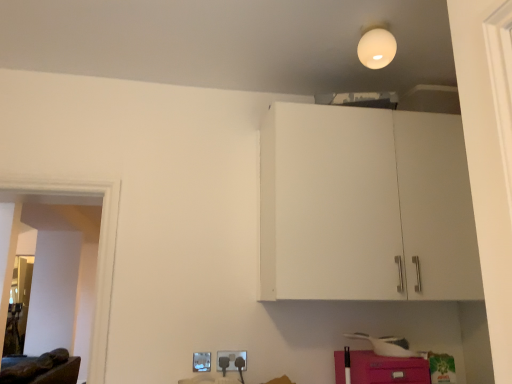
Question: From the image's perspective, is matte plastic electric outlet at lower center, which appears as the 1th electric outlet when viewed from the right, below brown leather couch at lower left?

Choices:
 (A) no
 (B) yes

Answer: (A)

Question: Considering the relative sizes of matte plastic electric outlet at lower center, which is the second electric outlet from left to right, and brown leather couch at lower left in the image provided, is matte plastic electric outlet at lower center, which is the second electric outlet from left to right, smaller than brown leather couch at lower left?

Choices:
 (A) no
 (B) yes

Answer: (B)

Question: Are matte plastic electric outlet at lower center, which is the second electric outlet from left to right, and brown leather couch at lower left far apart?

Choices:
 (A) yes
 (B) no

Answer: (A)

Question: Does matte plastic electric outlet at lower center, which appears as the 1th electric outlet when viewed from the right, touch brown leather couch at lower left?

Choices:
 (A) yes
 (B) no

Answer: (B)

Question: From a real-world perspective, does matte plastic electric outlet at lower center, which appears as the 1th electric outlet when viewed from the right, sit lower than brown leather couch at lower left?

Choices:
 (A) yes
 (B) no

Answer: (B)

Question: Is matte plastic electric outlet at lower center, which is the second electric outlet from left to right, to the left or to the right of white matte light bulb at upper center in the image?

Choices:
 (A) right
 (B) left

Answer: (B)

Question: From a real-world perspective, relative to white matte light bulb at upper center, is matte plastic electric outlet at lower center, which is the second electric outlet from left to right, vertically above or below?

Choices:
 (A) above
 (B) below

Answer: (B)

Question: In terms of height, does matte plastic electric outlet at lower center, which is the second electric outlet from left to right, look taller or shorter compared to white matte light bulb at upper center?

Choices:
 (A) tall
 (B) short

Answer: (B)

Question: Is matte plastic electric outlet at lower center, which appears as the 1th electric outlet when viewed from the right, spatially inside white matte light bulb at upper center, or outside of it?

Choices:
 (A) outside
 (B) inside

Answer: (A)

Question: From a real-world perspective, is white matte light bulb at upper center positioned above or below brown leather couch at lower left?

Choices:
 (A) below
 (B) above

Answer: (B)

Question: Is white matte light bulb at upper center to the left or to the right of brown leather couch at lower left in the image?

Choices:
 (A) right
 (B) left

Answer: (A)

Question: From their relative heights in the image, would you say white matte light bulb at upper center is taller or shorter than brown leather couch at lower left?

Choices:
 (A) tall
 (B) short

Answer: (B)

Question: In terms of size, does white matte light bulb at upper center appear bigger or smaller than brown leather couch at lower left?

Choices:
 (A) small
 (B) big

Answer: (A)

Question: From a real-world perspective, is pink matte cabinet at lower right physically located above or below brown leather couch at lower left?

Choices:
 (A) above
 (B) below

Answer: (A)

Question: From the image's perspective, is pink matte cabinet at lower right above or below brown leather couch at lower left?

Choices:
 (A) above
 (B) below

Answer: (A)